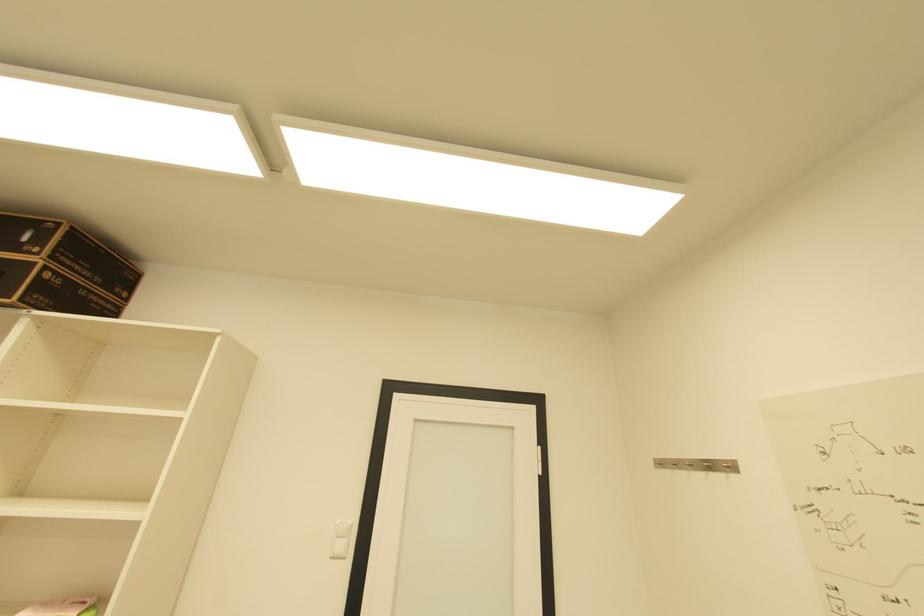
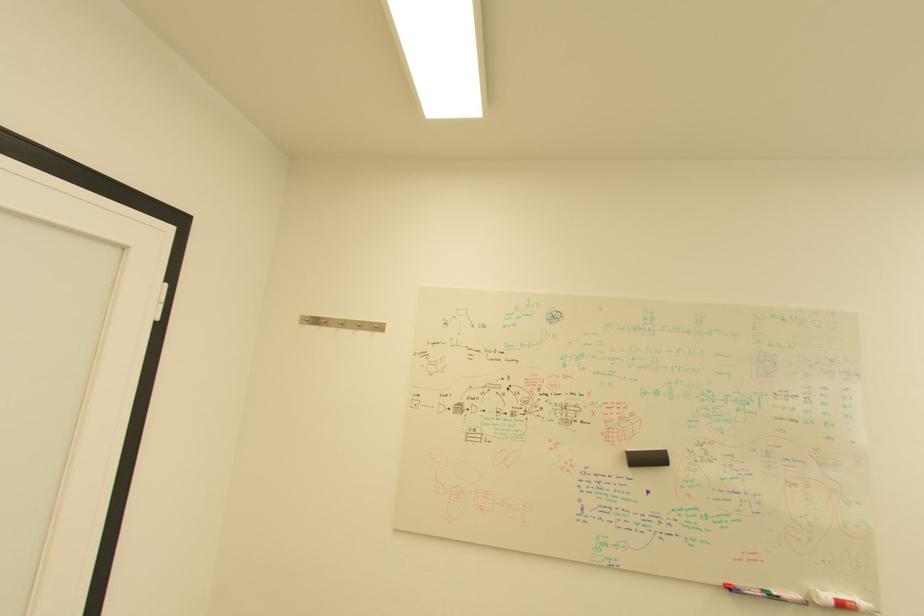
Question: The camera is either moving clockwise (left) or counter-clockwise (right) around the object. The first image is from the beginning of the video and the second image is from the end. Is the camera moving left or right when shooting the video?

Choices:
 (A) Left
 (B) Right

Answer: (A)